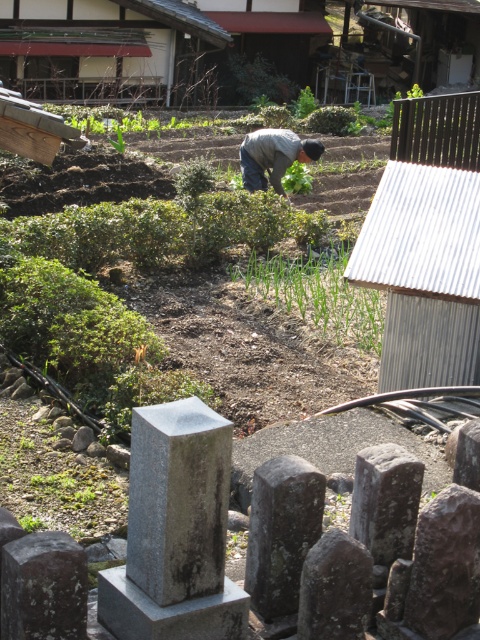
You are standing at the bottom of the image and want to walk towards the wooden hut at upper center. In which direction should you move?

You should move upward because the wooden hut at upper center is located at point (96, 48), which is in the upper part of the image.

You are a visitor to this rural Japanese area and want to take a photo of the wooden hut at upper center without the gray fabric at center appearing in the shot. How can you adjust your position to achieve this?

Move your position so that the wooden hut at upper center is no longer aligned with the gray fabric at center, as the wooden hut at upper center is positioned over gray fabric at center.